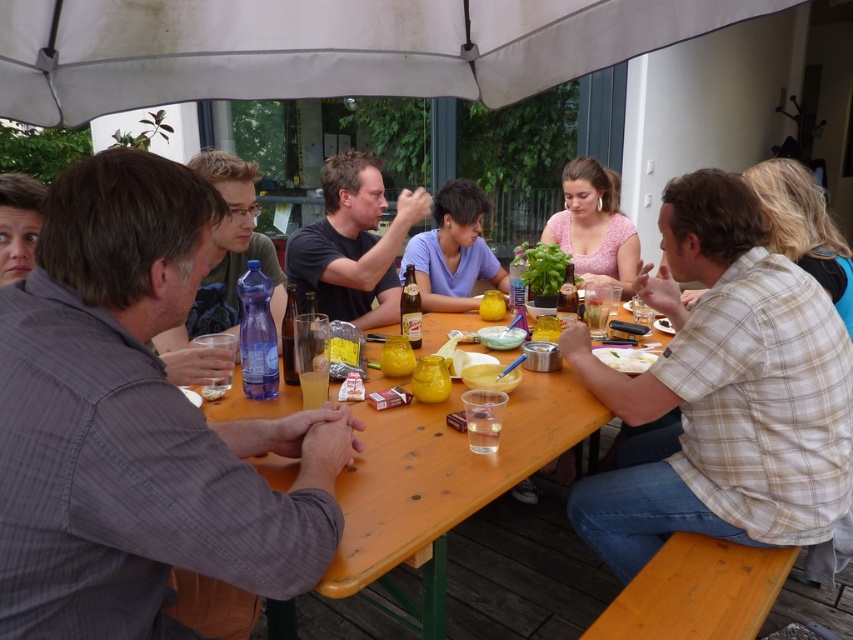
You are standing at the edge of the wooden deck where the gathering is taking place. You want to place a new plate on the wooden table at center. Based on the coordinates provided, can you confirm if the point marked at (444,477) is the correct location for the center of the table?

Yes, the point marked at (444,477) is the correct location for the center of the wooden table at center as stated in the description.

You are a photographer at the event and want to capture a photo of the light brown plaid shirt at right and the translucent plastic cup at table center. Which object is positioned higher in the image?

The light brown plaid shirt at right is above the translucent plastic cup at table center, so it is positioned higher in the image.

You are standing in front of the wooden table at center and want to reach a glass bottle placed on the edge of the table. If your arm can extend 36 inches, can you comfortably reach the bottle without moving closer?

The wooden table at center is 37.41 inches away from the viewer. Since your arm can only extend 36 inches, you cannot comfortably reach the bottle without moving closer.